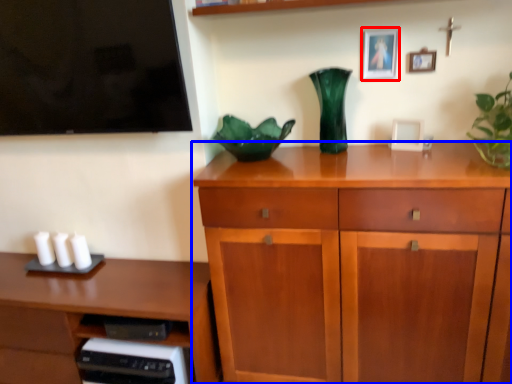
Question: Which object is further to the camera taking this photo, picture frame (highlighted by a red box) or chest of drawers (highlighted by a blue box)?

Choices:
 (A) picture frame
 (B) chest of drawers

Answer: (A)